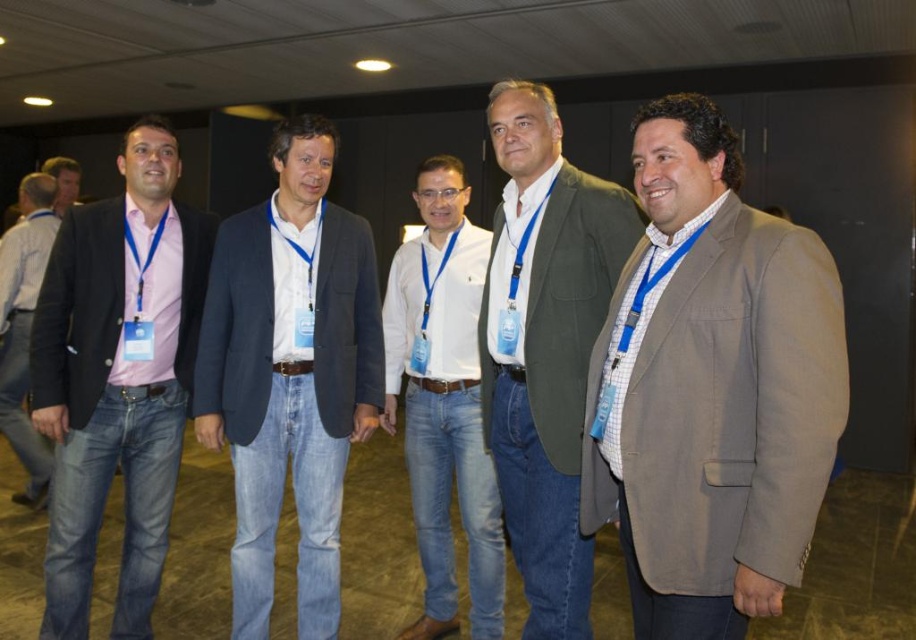
Based on the photo, does matte pink shirt at left appear over denim jeans at left?

Actually, matte pink shirt at left is below denim jeans at left.

Can you confirm if matte pink shirt at left is positioned to the left of denim jeans at left?

No, matte pink shirt at left is not to the left of denim jeans at left.

Is point (178, 435) in front of point (26, 317)?

Yes, point (178, 435) is in front of point (26, 317).

I want to click on matte pink shirt at left, so click(x=117, y=378).

Does point (704, 604) come in front of point (518, 212)?

Yes, it is.

Which of these two, gray textured blazer at center or white fabric tie at center, stands shorter?

Standing shorter between the two is white fabric tie at center.

Between point (606, 404) and point (520, 202), which one is positioned behind?

Positioned behind is point (520, 202).

You are a GUI agent. You are given a task and a screenshot of the screen. Output one action in this format:
    pyautogui.click(x=<x>, y=<y>)
    Task: Click on the gray textured blazer at center
    
    Given the screenshot: What is the action you would take?
    pyautogui.click(x=711, y=388)

Consider the image. Who is lower down, white glossy shirt at center or denim jeans at left?

white glossy shirt at center is below.

Is point (424, 396) positioned in front of point (23, 497)?

Yes, point (424, 396) is in front of point (23, 497).

Locate an element on the screen. white glossy shirt at center is located at coordinates (444, 401).